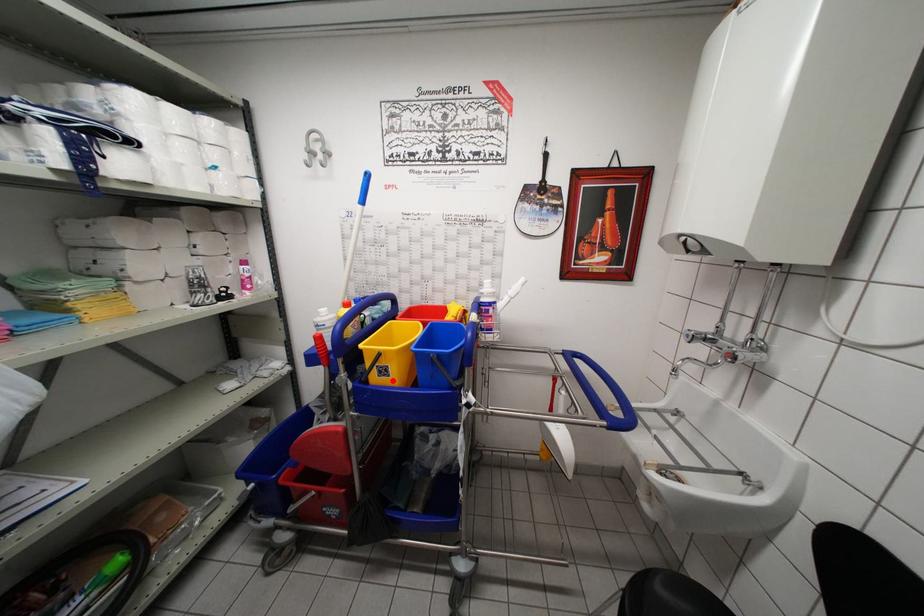
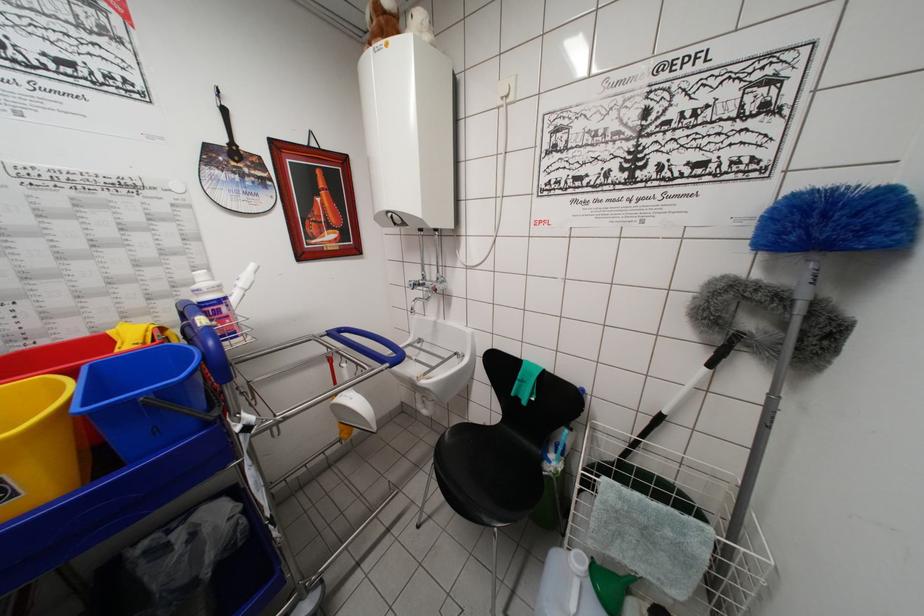
Question: I am providing you with two images of the same scene from different viewpoints. A red point is marked on the first image. Is the red point's position out of view in image 2?

Choices:
 (A) Yes
 (B) No

Answer: (B)